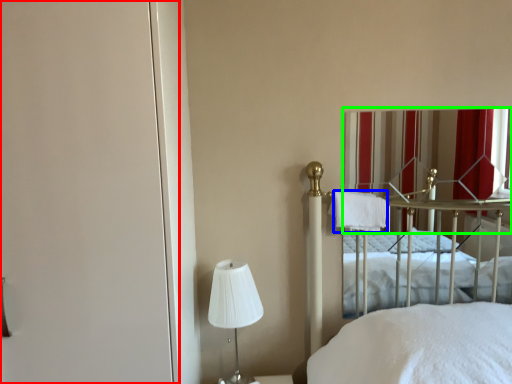
Question: Considering the real-world distances, which object is farthest from screen door (highlighted by a red box)? cloth (highlighted by a blue box) or curtain (highlighted by a green box)?

Choices:
 (A) cloth
 (B) curtain

Answer: (B)